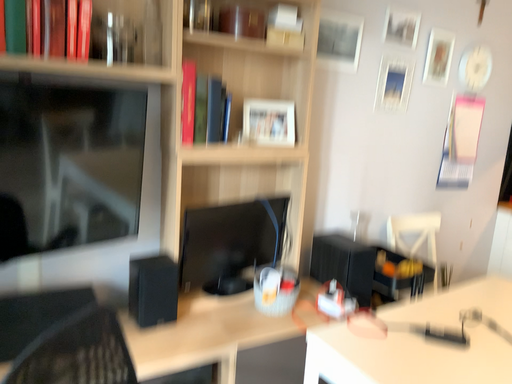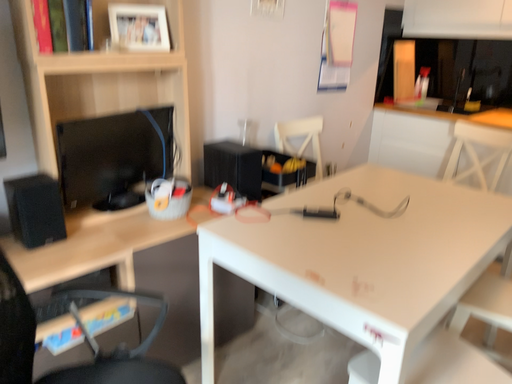
Question: How did the camera likely rotate when shooting the video?

Choices:
 (A) rotated right
 (B) rotated left

Answer: (A)